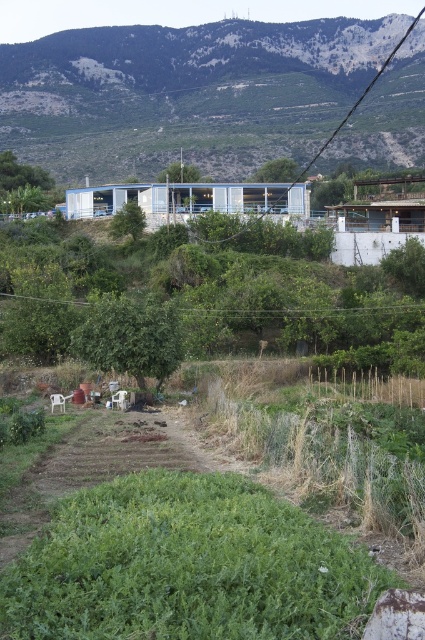
You are standing in the rural landscape scene and want to walk from the point at coordinates point (339, 90) to the point at coordinates point (345, 307). Which direction should you move to get closer to your destination?

Since point (339, 90) is further to the viewer than point (345, 307), you should move forward to get closer to your destination.

You are a drone operator trying to capture a photo of the green grassy hillside at upper center. The drone is currently at point A, which is at coordinates 0.1, 0.4. To get the best shot, you need to adjust the drone to the exact coordinates of the hillside. Should you move the drone north or south to align it properly?

The green grassy hillside at upper center is located at point (x=184, y=93). Since the drone is at (x=170, y=64), it needs to move north to increase the y coordinate from 0.4 to 0.435. Therefore, move north.